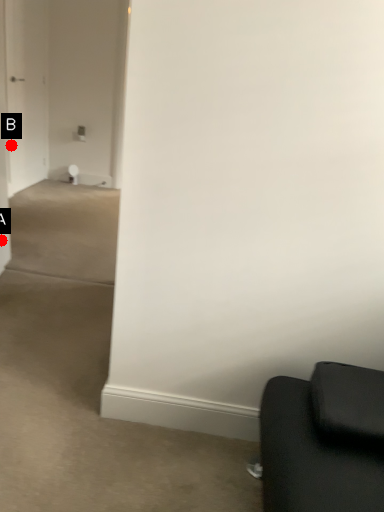
Question: Two points are circled on the image, labeled by A and B beside each circle. Which point appears closest to the camera in this image?

Choices:
 (A) A is closer
 (B) B is closer

Answer: (A)